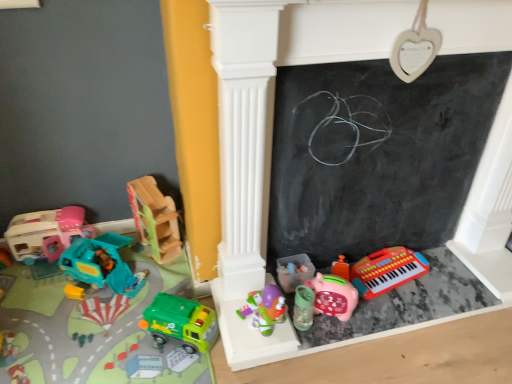
What do you see at coordinates (181, 322) in the screenshot? This screenshot has height=384, width=512. I see `green plastic toy truck at lower left, which is the 4th toy in right-to-left order` at bounding box center [181, 322].

Identify the location of teal plastic truck at left, the 6th toy in the right-to-left sequence. (101, 264).

What do you see at coordinates (101, 264) in the screenshot?
I see `teal plastic truck at left, the 6th toy in the right-to-left sequence` at bounding box center [101, 264].

The width and height of the screenshot is (512, 384). What do you see at coordinates (387, 270) in the screenshot?
I see `rubberized plastic keyboard at lower right, which is the 7th toy in left-to-right order` at bounding box center [387, 270].

You are a GUI agent. You are given a task and a screenshot of the screen. Output one action in this format:
    pyautogui.click(x=<x>, y=<y>)
    Task: Click on the wooden truck at left, acting as the 3th toy starting from the left
    The image size is (512, 384).
    Given the screenshot: What is the action you would take?
    tap(155, 219)

Describe the element at coordinates (46, 233) in the screenshot. I see `matte plastic playhouse at left, which is the first toy from left to right` at that location.

The image size is (512, 384). I want to click on translucent plastic toy at center, the third toy when ordered from right to left, so click(x=265, y=309).

From a real-world perspective, is translucent plastic toy at center, the third toy when ordered from right to left, physically located above or below teal plastic truck at left, the 6th toy in the right-to-left sequence?

In terms of real-world spatial position, translucent plastic toy at center, the third toy when ordered from right to left, is above teal plastic truck at left, the 6th toy in the right-to-left sequence.

Can you tell me how much translucent plastic toy at center, the 5th toy positioned from the left, and teal plastic truck at left, the 6th toy in the right-to-left sequence, differ in facing direction?

46.4 degrees.

From the image's perspective, count 2nd toys downward from the teal plastic truck at left, the 6th toy in the right-to-left sequence, and point to it. Please provide its 2D coordinates.

[(265, 309)]

Based on the photo, from the image's perspective, is translucent plastic toy at center, the third toy when ordered from right to left, beneath teal plastic truck at left, the 6th toy in the right-to-left sequence?

Yes, from the image's perspective, translucent plastic toy at center, the third toy when ordered from right to left, is below teal plastic truck at left, the 6th toy in the right-to-left sequence.

Who is bigger, rubberized plastic keyboard at lower right, which appears as the first toy when viewed from the right, or black chalkboard at center?

Bigger between the two is black chalkboard at center.

Where is `the 3rd toy below the black chalkboard at center (from the image's perspective)`? Image resolution: width=512 pixels, height=384 pixels. the 3rd toy below the black chalkboard at center (from the image's perspective) is located at coordinates (387, 270).

Is rubberized plastic keyboard at lower right, which appears as the first toy when viewed from the right, placed right next to black chalkboard at center?

No.

Which object is further away from the camera, pink matte piggy bank at lower center, positioned as the second toy in right-to-left order, or rubberized plastic keyboard at lower right, which appears as the first toy when viewed from the right?

rubberized plastic keyboard at lower right, which appears as the first toy when viewed from the right.

Considering the sizes of objects pink matte piggy bank at lower center, positioned as the second toy in right-to-left order, and rubberized plastic keyboard at lower right, which appears as the first toy when viewed from the right, in the image provided, who is thinner, pink matte piggy bank at lower center, positioned as the second toy in right-to-left order, or rubberized plastic keyboard at lower right, which appears as the first toy when viewed from the right,?

With smaller width is pink matte piggy bank at lower center, positioned as the second toy in right-to-left order.

Can you confirm if pink matte piggy bank at lower center, positioned as the second toy in right-to-left order, is smaller than rubberized plastic keyboard at lower right, which is the 7th toy in left-to-right order?

Correct, pink matte piggy bank at lower center, positioned as the second toy in right-to-left order, occupies less space than rubberized plastic keyboard at lower right, which is the 7th toy in left-to-right order.

Where is `the 2nd toy in front when counting from the rubberized plastic keyboard at lower right, which appears as the first toy when viewed from the right`? This screenshot has width=512, height=384. the 2nd toy in front when counting from the rubberized plastic keyboard at lower right, which appears as the first toy when viewed from the right is located at coordinates (334, 296).

From the image's perspective, would you say green plastic toy truck at lower left, which is the 4th toy in right-to-left order, is positioned over matte plastic playhouse at left, which is the first toy from left to right?

No.

From a real-world perspective, is green plastic toy truck at lower left, the fourth toy positioned from the left, located higher than matte plastic playhouse at left, positioned as the seventh toy in right-to-left order?

Incorrect, from a real-world perspective, green plastic toy truck at lower left, the fourth toy positioned from the left, is lower than matte plastic playhouse at left, positioned as the seventh toy in right-to-left order.

Considering the sizes of objects green plastic toy truck at lower left, the fourth toy positioned from the left, and matte plastic playhouse at left, which is the first toy from left to right, in the image provided, who is shorter, green plastic toy truck at lower left, the fourth toy positioned from the left, or matte plastic playhouse at left, which is the first toy from left to right,?

green plastic toy truck at lower left, the fourth toy positioned from the left.

Between green plastic toy truck at lower left, the fourth toy positioned from the left, and matte plastic playhouse at left, positioned as the seventh toy in right-to-left order, which one appears on the right side from the viewer's perspective?

green plastic toy truck at lower left, the fourth toy positioned from the left, is more to the right.

Would you say matte plastic playhouse at left, which is the first toy from left to right, is a long distance from translucent plastic toy at center, the third toy when ordered from right to left?

matte plastic playhouse at left, which is the first toy from left to right, is near translucent plastic toy at center, the third toy when ordered from right to left, not far away.

Could you tell me if matte plastic playhouse at left, which is the first toy from left to right, is facing translucent plastic toy at center, the third toy when ordered from right to left?

No, matte plastic playhouse at left, which is the first toy from left to right, is not aimed at translucent plastic toy at center, the third toy when ordered from right to left.

Choose the correct answer: Is matte plastic playhouse at left, positioned as the seventh toy in right-to-left order, inside translucent plastic toy at center, the third toy when ordered from right to left, or outside it?

matte plastic playhouse at left, positioned as the seventh toy in right-to-left order, is not enclosed by translucent plastic toy at center, the third toy when ordered from right to left.

Between point (42, 255) and point (261, 327), which one is positioned in front?

The point (261, 327) is closer to the camera.

Does translucent plastic toy at center, the third toy when ordered from right to left, have a greater width compared to rubberized plastic keyboard at lower right, which appears as the first toy when viewed from the right?

Incorrect, the width of translucent plastic toy at center, the third toy when ordered from right to left, does not surpass that of rubberized plastic keyboard at lower right, which appears as the first toy when viewed from the right.

From the image's perspective, is translucent plastic toy at center, the third toy when ordered from right to left, positioned above or below rubberized plastic keyboard at lower right, which is the 7th toy in left-to-right order?

translucent plastic toy at center, the third toy when ordered from right to left, is below rubberized plastic keyboard at lower right, which is the 7th toy in left-to-right order.

Is translucent plastic toy at center, the third toy when ordered from right to left, looking in the opposite direction of rubberized plastic keyboard at lower right, which is the 7th toy in left-to-right order?

No, rubberized plastic keyboard at lower right, which is the 7th toy in left-to-right order, is not at the back of translucent plastic toy at center, the third toy when ordered from right to left.

Based on their positions, is matte plastic playhouse at left, positioned as the seventh toy in right-to-left order, located to the left or right of green plastic toy truck at lower left, which is the 4th toy in right-to-left order?

In the image, matte plastic playhouse at left, positioned as the seventh toy in right-to-left order, appears on the left side of green plastic toy truck at lower left, which is the 4th toy in right-to-left order.

In the scene shown: Between matte plastic playhouse at left, which is the first toy from left to right, and green plastic toy truck at lower left, the fourth toy positioned from the left, which one is positioned behind?

Positioned behind is matte plastic playhouse at left, which is the first toy from left to right.

Where is `toy that is the 5th one when counting forward from the matte plastic playhouse at left, which is the first toy from left to right`? toy that is the 5th one when counting forward from the matte plastic playhouse at left, which is the first toy from left to right is located at coordinates click(181, 322).

Find the location of a particular element. toy that is the 4th one below the translucent plastic toy at center, the 5th toy positioned from the left (from a real-world perspective) is located at coordinates (101, 264).

The height and width of the screenshot is (384, 512). In order to click on bulletin board located in front of the rubberized plastic keyboard at lower right, which appears as the first toy when viewed from the right in this screenshot , I will do `click(377, 154)`.

Estimate the real-world distances between objects in this image. Which object is further from green plastic toy truck at lower left, the fourth toy positioned from the left, matte plastic playhouse at left, positioned as the seventh toy in right-to-left order, or translucent plastic toy at center, the third toy when ordered from right to left?

matte plastic playhouse at left, positioned as the seventh toy in right-to-left order, is further to green plastic toy truck at lower left, the fourth toy positioned from the left.

Based on their spatial positions, is black chalkboard at center or pink plastic keyboard at lower right further from teal plastic truck at left, which appears as the second toy when viewed from the left?

black chalkboard at center is positioned further to the anchor teal plastic truck at left, which appears as the second toy when viewed from the left.

Which object lies further to the anchor point pink plastic keyboard at lower right, wooden truck at left, acting as the 3th toy starting from the left, or green plastic toy truck at lower left, the fourth toy positioned from the left?

wooden truck at left, acting as the 3th toy starting from the left, is positioned further to the anchor pink plastic keyboard at lower right.

Looking at the image, which one is located closer to pink plastic keyboard at lower right, wooden truck at left, the fifth toy in the right-to-left sequence, or matte plastic playhouse at left, which is the first toy from left to right?

wooden truck at left, the fifth toy in the right-to-left sequence, is positioned closer to the anchor pink plastic keyboard at lower right.

From the image, which object appears to be nearer to green plastic toy truck at lower left, which is the 4th toy in right-to-left order, rubberized plastic keyboard at lower right, which is the 7th toy in left-to-right order, or pink matte piggy bank at lower center, positioned as the second toy in right-to-left order?

Based on the image, pink matte piggy bank at lower center, positioned as the second toy in right-to-left order, appears to be nearer to green plastic toy truck at lower left, which is the 4th toy in right-to-left order.

Estimate the real-world distances between objects in this image. Which object is further from pink matte piggy bank at lower center, which is the 6th toy in left-to-right order, pink plastic keyboard at lower right or translucent plastic toy at center, the third toy when ordered from right to left?

Among the two, pink plastic keyboard at lower right is located further to pink matte piggy bank at lower center, which is the 6th toy in left-to-right order.

Looking at the image, which one is located closer to green plastic toy truck at lower left, the fourth toy positioned from the left, wooden truck at left, acting as the 3th toy starting from the left, or rubberized plastic keyboard at lower right, which appears as the first toy when viewed from the right?

wooden truck at left, acting as the 3th toy starting from the left, is closer to green plastic toy truck at lower left, the fourth toy positioned from the left.

Which object lies nearer to the anchor point green plastic toy truck at lower left, which is the 4th toy in right-to-left order, black chalkboard at center or matte plastic playhouse at left, positioned as the seventh toy in right-to-left order?

Among the two, matte plastic playhouse at left, positioned as the seventh toy in right-to-left order, is located nearer to green plastic toy truck at lower left, which is the 4th toy in right-to-left order.

Find the location of a particular element. toy between matte plastic playhouse at left, positioned as the seventh toy in right-to-left order, and wooden truck at left, the fifth toy in the right-to-left sequence is located at coordinates (101, 264).

The width and height of the screenshot is (512, 384). Identify the location of bulletin board located between green plastic toy truck at lower left, which is the 4th toy in right-to-left order, and rubberized plastic keyboard at lower right, which appears as the first toy when viewed from the right, in the left-right direction. (377, 154).

The width and height of the screenshot is (512, 384). I want to click on bulletin board between teal plastic truck at left, which appears as the second toy when viewed from the left, and rubberized plastic keyboard at lower right, which is the 7th toy in left-to-right order, from left to right, so click(x=377, y=154).

The width and height of the screenshot is (512, 384). Find the location of `toy located between translucent plastic toy at center, the third toy when ordered from right to left, and pink plastic keyboard at lower right in the left-right direction`. toy located between translucent plastic toy at center, the third toy when ordered from right to left, and pink plastic keyboard at lower right in the left-right direction is located at coordinates (334, 296).